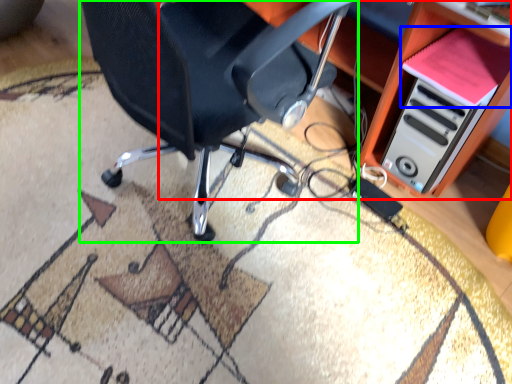
Question: Which is farther away from computer desk (highlighted by a red box)? book (highlighted by a blue box) or chair (highlighted by a green box)?

Choices:
 (A) book
 (B) chair

Answer: (B)